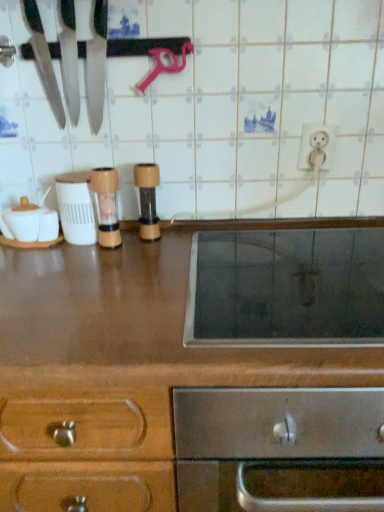
The image size is (384, 512). I want to click on free space in front of wooden pepper grinder at center, the second appliance in the left-to-right sequence, so click(100, 272).